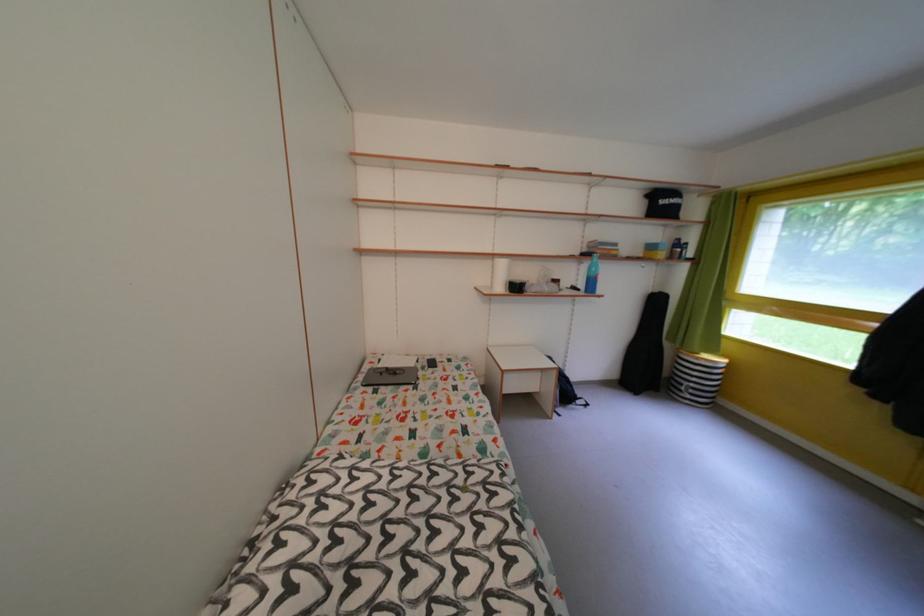
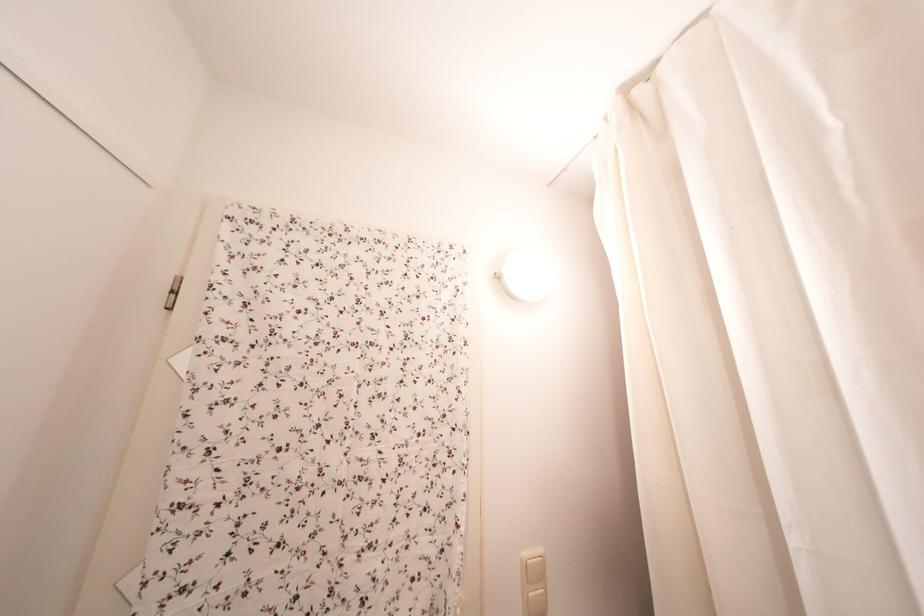
First-person continuous shooting, in which direction is the camera rotating?

The camera's rotation is toward left-up.